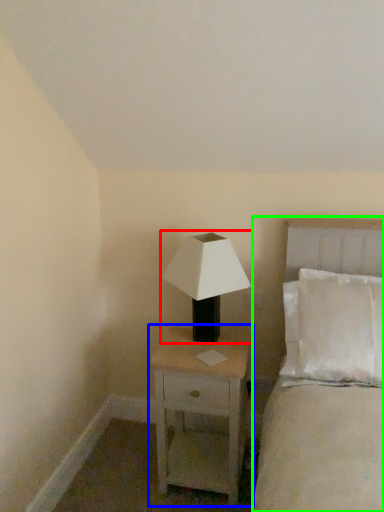
Question: Considering the real-world distances, which object is farthest from lamp (highlighted by a red box)? nightstand (highlighted by a blue box) or bed (highlighted by a green box)?

Choices:
 (A) nightstand
 (B) bed

Answer: (B)